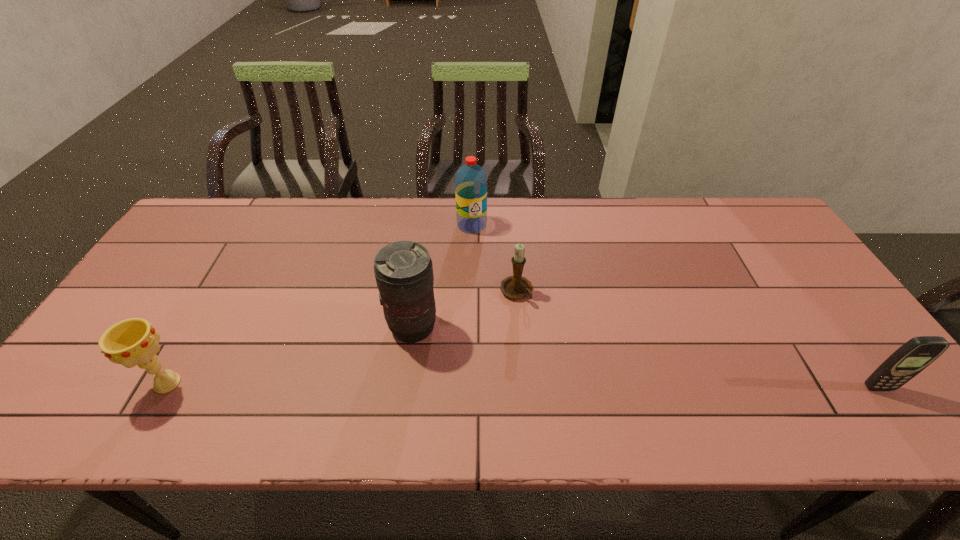
Locate an element on the screen. the leftmost object is located at coordinates (130, 342).

Find the location of a particular element. The width and height of the screenshot is (960, 540). the rightmost object is located at coordinates (915, 355).

This screenshot has height=540, width=960. What are the coordinates of `the third object from left to right` in the screenshot? It's located at (470, 180).

Locate an element on the screen. The width and height of the screenshot is (960, 540). the farthest object is located at coordinates (470, 180).

At what (x,y) coordinates should I click in order to perform the action: click on the third farthest object. Please return your answer as a coordinate pair (x, y). Looking at the image, I should click on (403, 270).

At what (x,y) coordinates should I click in order to perform the action: click on the fourth object from right to left. Please return your answer as a coordinate pair (x, y). This screenshot has height=540, width=960. Looking at the image, I should click on (403, 270).

At what (x,y) coordinates should I click in order to perform the action: click on candle holder. Please return your answer as a coordinate pair (x, y). Looking at the image, I should click on (515, 287).

Where is `the fourth nearest object`? Image resolution: width=960 pixels, height=540 pixels. the fourth nearest object is located at coordinates (515, 287).

What are the coordinates of `free space located on the left of the leftmost object` in the screenshot? It's located at (x=94, y=383).

Locate an element on the screen. vacant space located on the front label of the water bottle is located at coordinates (480, 289).